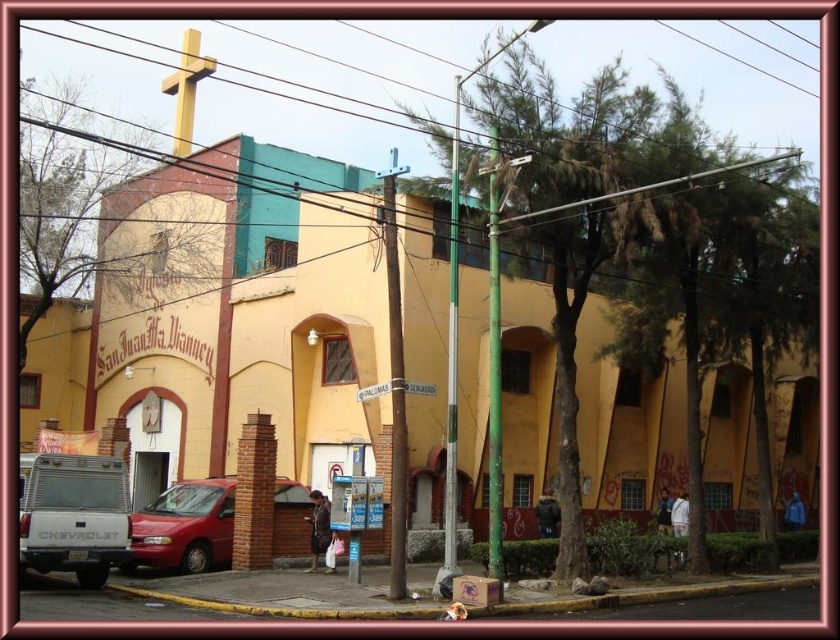
Can you confirm if matte silver truck at lower left is wider than metallic red van at lower left?

No.

I want to click on matte silver truck at lower left, so click(x=72, y=515).

How much distance is there between matte silver truck at lower left and gold metallic cross at upper center?

matte silver truck at lower left is 72.25 feet from gold metallic cross at upper center.

Is matte silver truck at lower left above gold metallic cross at upper center?

Incorrect, matte silver truck at lower left is not positioned above gold metallic cross at upper center.

Which is in front, point (82, 572) or point (193, 42)?

Point (82, 572) is in front.

This screenshot has height=640, width=840. I want to click on matte silver truck at lower left, so click(72, 515).

Between yellow matte building at center and metallic red van at lower left, which one has less height?

Standing shorter between the two is metallic red van at lower left.

Does yellow matte building at center appear on the left side of metallic red van at lower left?

No, yellow matte building at center is not to the left of metallic red van at lower left.

The width and height of the screenshot is (840, 640). I want to click on yellow matte building at center, so click(312, 336).